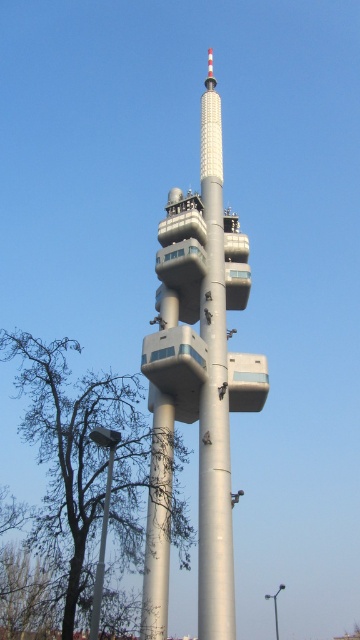
Does silver metallic tower at center appear on the right side of metallic gray pole at lower left?

Yes, silver metallic tower at center is to the right of metallic gray pole at lower left.

Who is positioned more to the left, silver metallic tower at center or metallic gray pole at lower left?

From the viewer's perspective, metallic gray pole at lower left appears more on the left side.

Which is behind, point (167, 205) or point (110, 470)?

Positioned behind is point (167, 205).

Locate an element on the screen. This screenshot has width=360, height=640. silver metallic tower at center is located at coordinates (198, 380).

Does brown leafless tree at lower left appear over metallic gray pole at lower left?

Actually, brown leafless tree at lower left is below metallic gray pole at lower left.

The height and width of the screenshot is (640, 360). Describe the element at coordinates (79, 461) in the screenshot. I see `brown leafless tree at lower left` at that location.

Image resolution: width=360 pixels, height=640 pixels. What are the coordinates of `brown leafless tree at lower left` in the screenshot? It's located at (79, 461).

Is point (159, 609) behind point (119, 620)?

No.

Between point (203, 547) and point (59, 378), which one is positioned behind?

Positioned behind is point (59, 378).

What do you see at coordinates (198, 380) in the screenshot?
I see `silver metallic tower at center` at bounding box center [198, 380].

The height and width of the screenshot is (640, 360). Find the location of `silver metallic tower at center`. silver metallic tower at center is located at coordinates (198, 380).